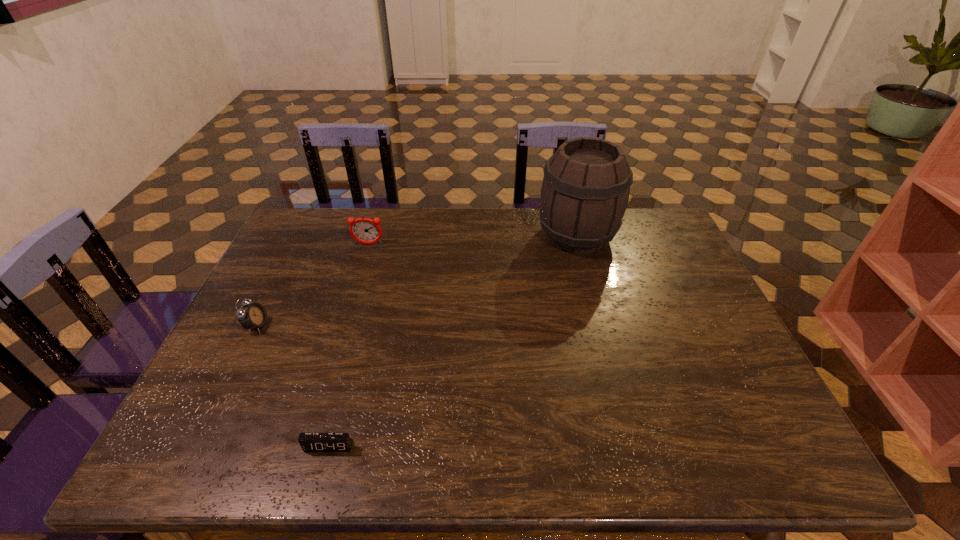
The width and height of the screenshot is (960, 540). What are the coordinates of `the tallest object` in the screenshot? It's located at click(585, 190).

Where is `the rightmost object`? The height and width of the screenshot is (540, 960). the rightmost object is located at coordinates (585, 190).

The height and width of the screenshot is (540, 960). I want to click on the second tallest object, so click(364, 230).

Locate an element on the screen. The height and width of the screenshot is (540, 960). the farthest alarm clock is located at coordinates (364, 230).

At what (x,y) coordinates should I click in order to perform the action: click on the second nearest alarm clock. Please return your answer as a coordinate pair (x, y). This screenshot has width=960, height=540. Looking at the image, I should click on (252, 316).

The width and height of the screenshot is (960, 540). Find the location of `the leftmost object`. the leftmost object is located at coordinates (252, 316).

This screenshot has width=960, height=540. In order to click on the nearest object in this screenshot , I will do `click(310, 442)`.

The height and width of the screenshot is (540, 960). Find the location of `the shortest object`. the shortest object is located at coordinates (310, 442).

This screenshot has height=540, width=960. What are the coordinates of `blank space located 0.060m on the front of the wine bucket` in the screenshot? It's located at (587, 274).

Locate an element on the screen. The width and height of the screenshot is (960, 540). vacant space located on the front-facing side of the third shortest object is located at coordinates (364, 260).